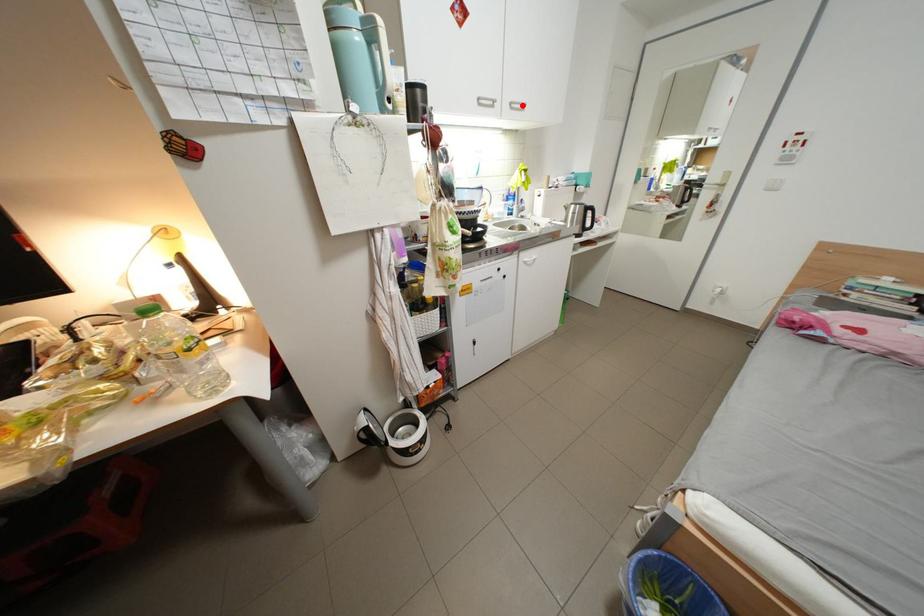
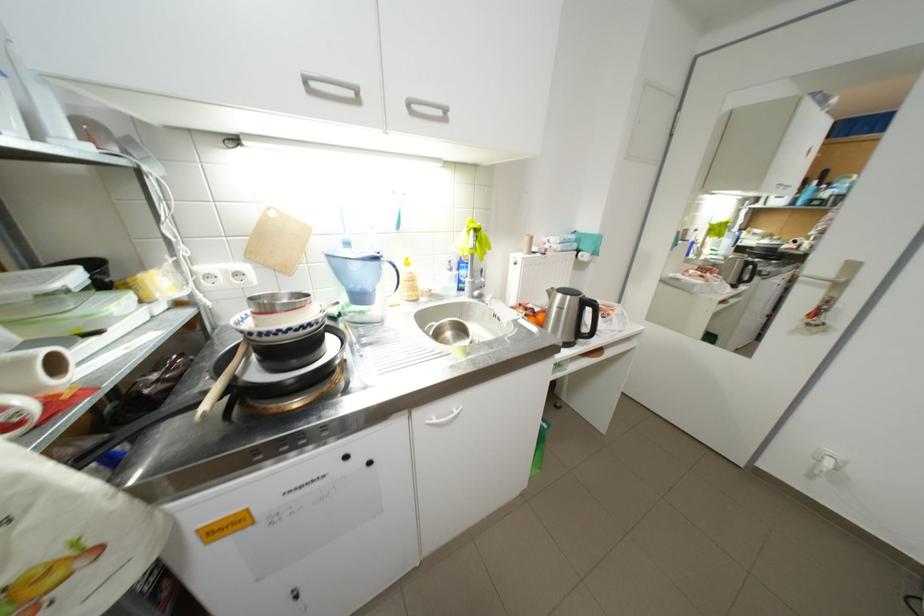
In the second image, find the point that corresponds to the highlighted location in the first image.

(420, 105)